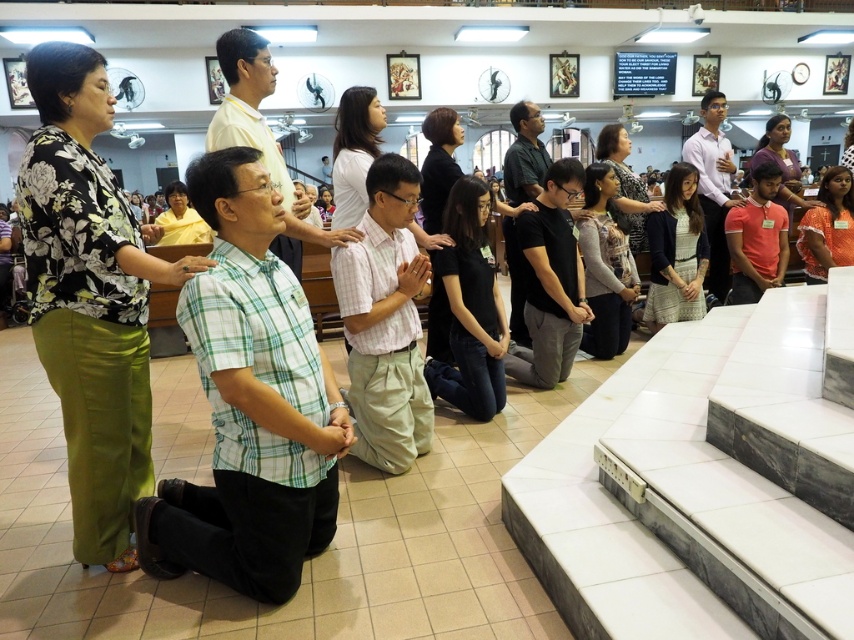
You are a photographer taking a picture of the group in the church. You notice the green plaid shirt at center and the dark green shirt at center. Which shirt should you adjust in your frame to ensure both are fully visible?

You should adjust the frame to account for the green plaid shirt at center, since it is shorter than the dark green shirt at center and might not be fully visible if the frame is set based on the taller dark green shirt at center.

You are a photographer standing at the back of the church. You want to take a photo of the light pink plaid shirt at center and the dark green shirt at center so that both are clearly visible. Considering the distance between them, will you need to adjust your camera to a wider angle to capture both in the frame?

The light pink plaid shirt at center is 6.29 feet from the dark green shirt at center. To capture both in the frame, you would need to adjust your camera to a wider angle since the distance between them is significant.